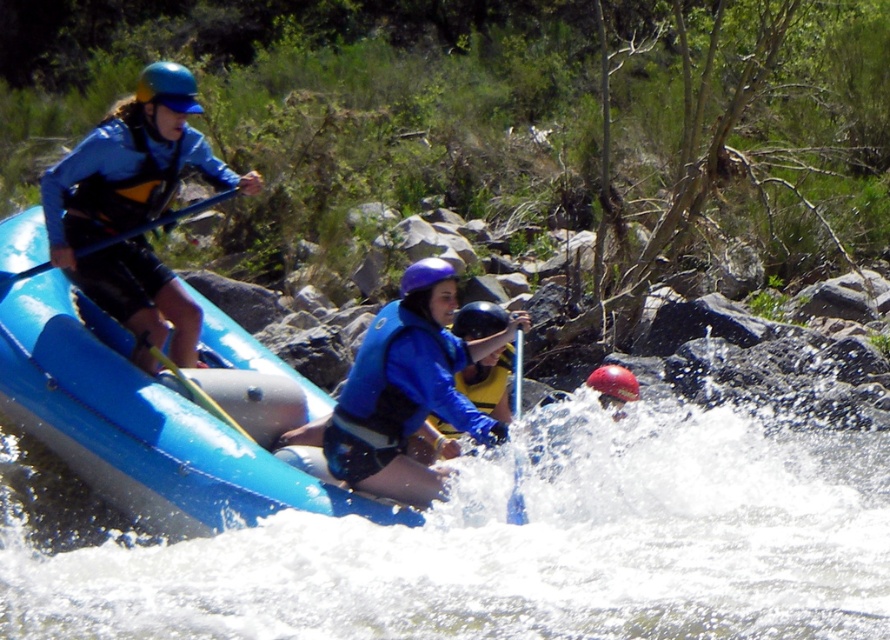
You are a safety inspector checking the rafting gear. You notice the blue matte life vest at center and the shiny blue helmet at upper left. Which gear is positioned closer to you?

The blue matte life vest at center is closer to the viewer than the shiny blue helmet at upper left.

You are a safety inspector checking the rafting gear. You notice two helmets at the center of the raft. Which helmet is positioned higher up, the matte blue helmet at center or the rubber helmet at center?

The matte blue helmet at center is located above the rubber helmet at center, so it is positioned higher up.